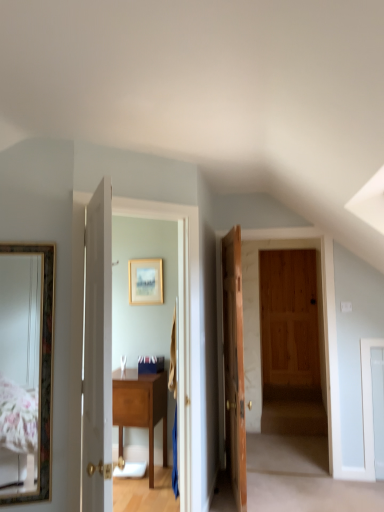
Question: Is gold-framed mirror at left positioned with its back to wooden door at center, which ranks as the second door in left-to-right order?

Choices:
 (A) yes
 (B) no

Answer: (B)

Question: Could you tell me if gold-framed mirror at left is facing wooden door at center, which appears as the first door when viewed from the back?

Choices:
 (A) yes
 (B) no

Answer: (B)

Question: Can you confirm if gold-framed mirror at left is wider than wooden door at center, arranged as the first door when viewed from the right?

Choices:
 (A) yes
 (B) no

Answer: (B)

Question: Is gold-framed mirror at left smaller than wooden door at center, which ranks as the second door in left-to-right order?

Choices:
 (A) no
 (B) yes

Answer: (B)

Question: Does gold-framed mirror at left have a larger size compared to wooden door at center, which ranks as the second door in left-to-right order?

Choices:
 (A) yes
 (B) no

Answer: (B)

Question: From a real-world perspective, is gold-framed mirror at left physically below wooden door at center, which ranks as the second door in left-to-right order?

Choices:
 (A) yes
 (B) no

Answer: (B)

Question: Is wooden table at center in front of white wooden door at center, which ranks as the first door in left-to-right order?

Choices:
 (A) yes
 (B) no

Answer: (B)

Question: Is wooden table at center thinner than white wooden door at center, positioned as the 2th door in right-to-left order?

Choices:
 (A) no
 (B) yes

Answer: (A)

Question: Considering the relative sizes of wooden table at center and white wooden door at center, which ranks as the first door in left-to-right order, in the image provided, is wooden table at center shorter than white wooden door at center, which ranks as the first door in left-to-right order,?

Choices:
 (A) no
 (B) yes

Answer: (B)

Question: From a real-world perspective, is wooden table at center physically below white wooden door at center, which is counted as the 1th door, starting from the front?

Choices:
 (A) no
 (B) yes

Answer: (B)

Question: Does wooden table at center contain white wooden door at center, which ranks as the first door in left-to-right order?

Choices:
 (A) no
 (B) yes

Answer: (A)

Question: Is wooden table at center turned away from white wooden door at center, which is the second door from back to front?

Choices:
 (A) no
 (B) yes

Answer: (A)

Question: Is white wooden door at center, which ranks as the first door in left-to-right order, bigger than gold-framed picture at center?

Choices:
 (A) no
 (B) yes

Answer: (B)